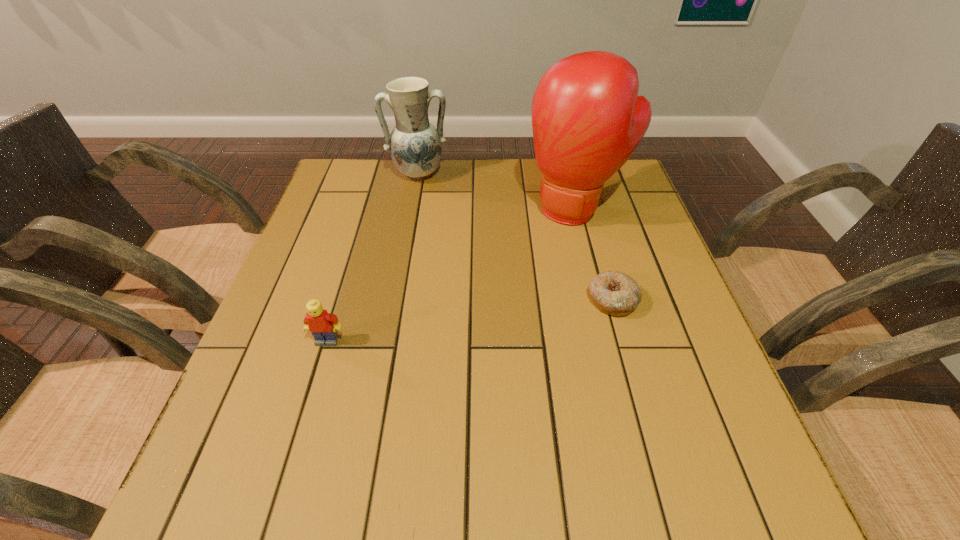
Locate an element on the screen. This screenshot has height=540, width=960. free point between the nearest object and the shortest object is located at coordinates (469, 320).

Identify the location of empty space that is in between the Lego and the shortest object. This screenshot has height=540, width=960. (469, 320).

You are a GUI agent. You are given a task and a screenshot of the screen. Output one action in this format:
    pyautogui.click(x=<x>, y=<y>)
    Task: Click on the vacant area between the Lego and the tallest object
    Image resolution: width=960 pixels, height=540 pixels.
    Given the screenshot: What is the action you would take?
    pyautogui.click(x=451, y=275)

Locate an element on the screen. This screenshot has width=960, height=540. blank region between the shortest object and the tallest object is located at coordinates (594, 254).

The image size is (960, 540). I want to click on free spot between the third tallest object and the pottery, so (x=372, y=258).

Identify which object is located as the second nearest to the shortest object. Please provide its 2D coordinates. Your answer should be formatted as a tuple, i.e. [(x, y)], where the tuple contains the x and y coordinates of a point satisfying the conditions above.

[(415, 145)]

I want to click on object that stands as the third closest to the boxing glove, so click(322, 325).

This screenshot has height=540, width=960. Find the location of `vacant area that satisfies the following two spatial constraints: 1. on the front side of the shortest object; 2. on the left side of the tallest object`. vacant area that satisfies the following two spatial constraints: 1. on the front side of the shortest object; 2. on the left side of the tallest object is located at coordinates (598, 299).